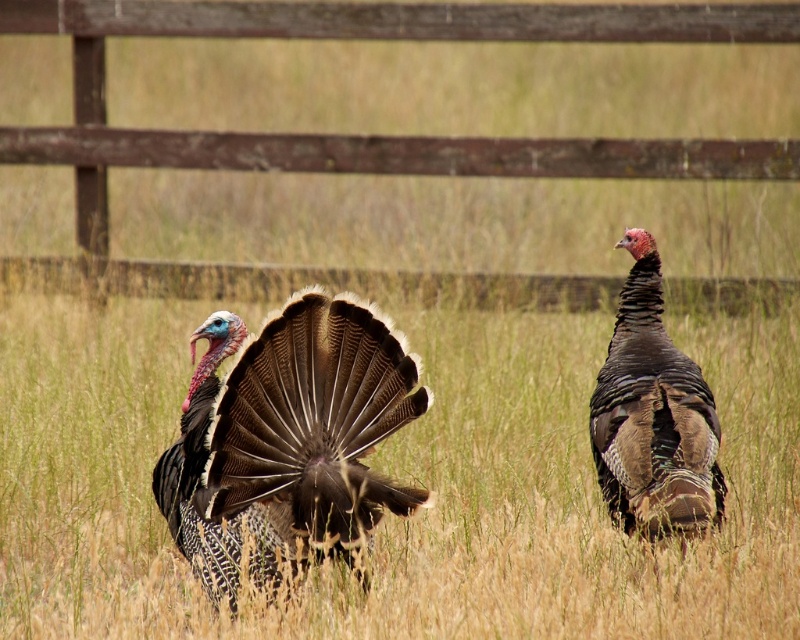
Question: Is wooden fence at upper center positioned in front of shiny brown turkey at center?

Choices:
 (A) no
 (B) yes

Answer: (A)

Question: Does shiny brown turkey at center lie in front of dark brown feathers at right?

Choices:
 (A) no
 (B) yes

Answer: (B)

Question: From the image, what is the correct spatial relationship of wooden fence at upper center in relation to dark brown feathers at right?

Choices:
 (A) right
 (B) left

Answer: (B)

Question: Which point is farther to the camera?

Choices:
 (A) (290, 419)
 (B) (760, 160)
 (C) (694, 380)

Answer: (B)

Question: Which of these objects is positioned farthest from the wooden fence at upper center?

Choices:
 (A) dark brown feathers at right
 (B) shiny brown turkey at center

Answer: (B)

Question: Which object is closer to the camera taking this photo?

Choices:
 (A) dark brown feathers at right
 (B) wooden fence at upper center
 (C) shiny brown turkey at center

Answer: (C)